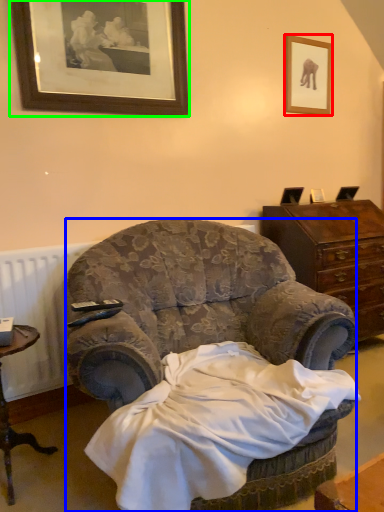
Question: Which is farther away from picture frame (highlighted by a red box)? chair (highlighted by a blue box) or picture frame (highlighted by a green box)?

Choices:
 (A) chair
 (B) picture frame

Answer: (A)